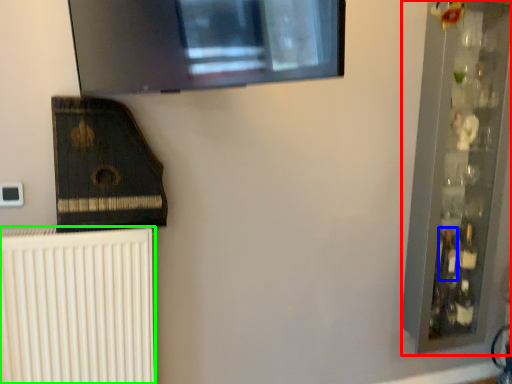
Question: Which object is positioned closest to shelf (highlighted by a red box)? Select from bottle (highlighted by a blue box) and radiator (highlighted by a green box).

Choices:
 (A) bottle
 (B) radiator

Answer: (A)